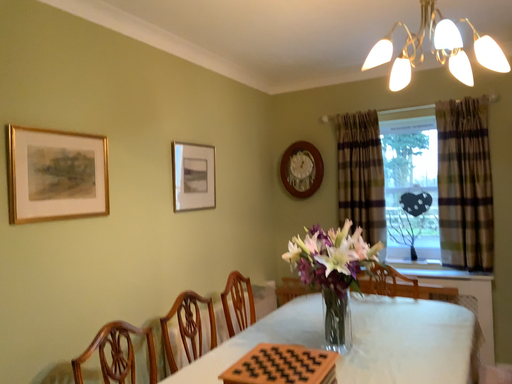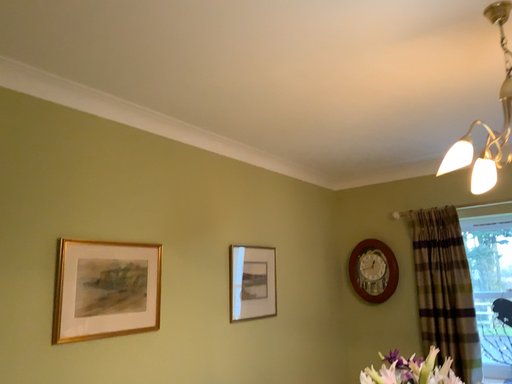
Question: Which way did the camera rotate in the video?

Choices:
 (A) rotated left
 (B) rotated right

Answer: (A)